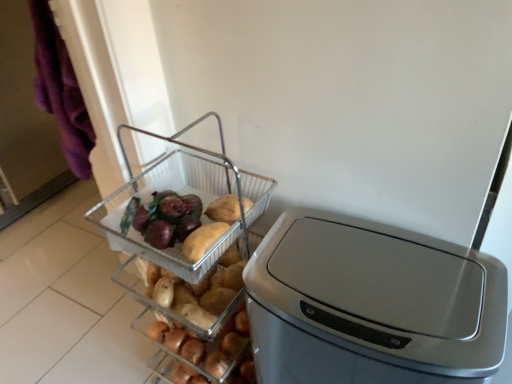
Locate an element on the screen. Image resolution: width=512 pixels, height=384 pixels. free space above satin silver trash can at center (from a real-world perspective) is located at coordinates (393, 277).